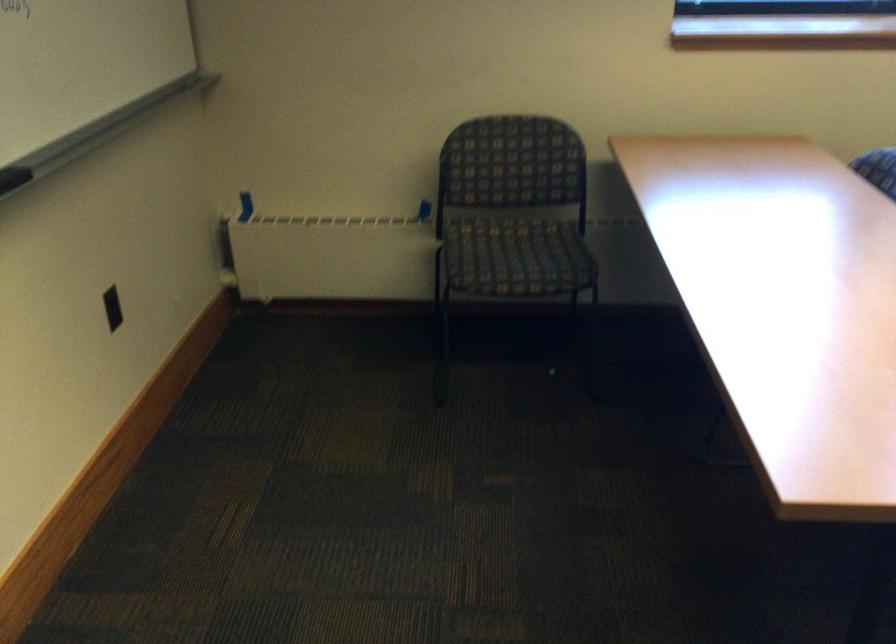
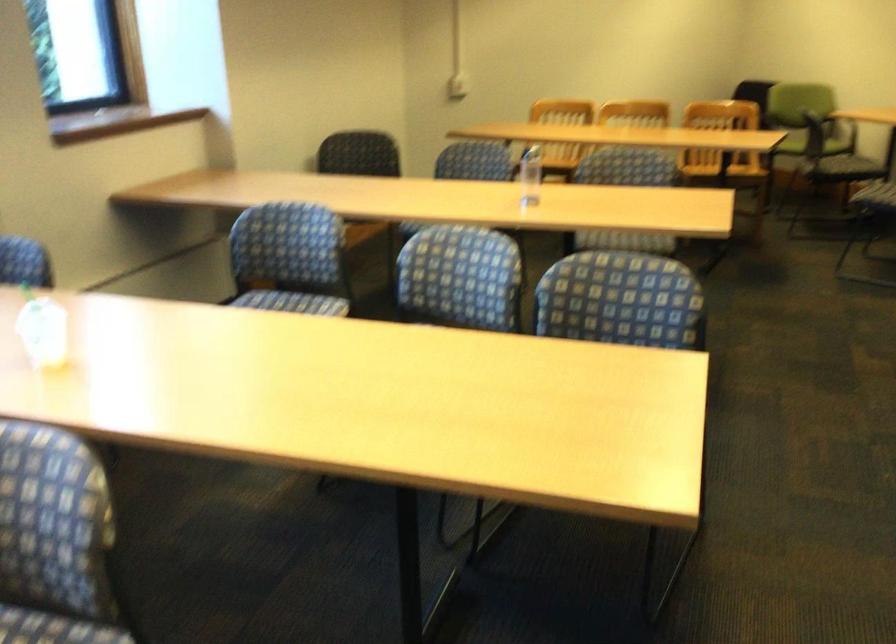
Question: The first image is from the beginning of the video and the second image is from the end. How did the camera likely rotate when shooting the video?

Choices:
 (A) Left
 (B) Right
 (C) Up
 (D) Down

Answer: (B)